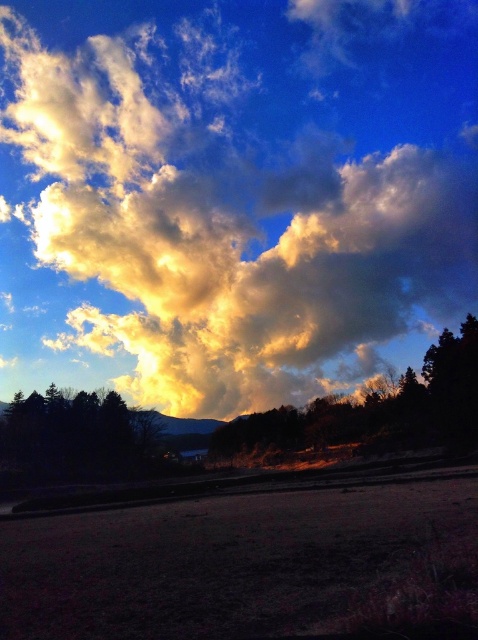
Question: Can you confirm if cloudy sky at upper center is positioned below dark green textured trees at lower left?

Choices:
 (A) yes
 (B) no

Answer: (B)

Question: Which point appears farthest from the camera in this image?

Choices:
 (A) (78, 179)
 (B) (141, 468)

Answer: (A)

Question: Based on their relative distances, which object is farther from the dark green textured trees at lower left?

Choices:
 (A) smooth brown tree at center
 (B) cloudy sky at upper center

Answer: (B)

Question: Which object is positioned farthest from the smooth brown tree at center?

Choices:
 (A) cloudy sky at upper center
 (B) dark green textured trees at lower left

Answer: (A)

Question: Where is smooth brown tree at center located in relation to dark green textured trees at lower left in the image?

Choices:
 (A) right
 (B) left

Answer: (A)

Question: Is cloudy sky at upper center wider than dark green textured trees at lower left?

Choices:
 (A) no
 (B) yes

Answer: (B)